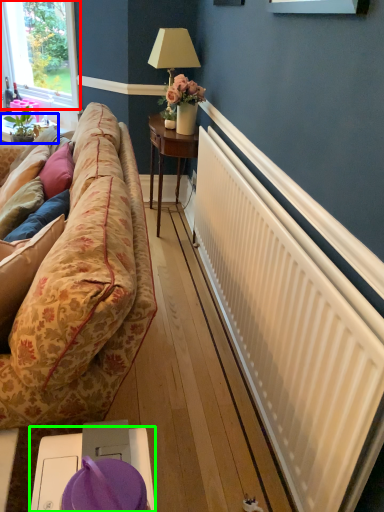
Question: Which object is positioned closest to window (highlighted by a red box)? Select from table (highlighted by a blue box) and table (highlighted by a green box).

Choices:
 (A) table
 (B) table

Answer: (A)